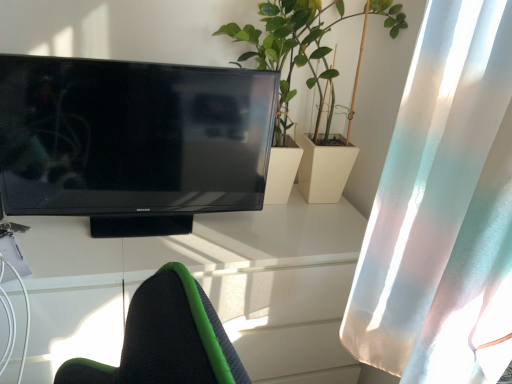
Question: Is white glossy desk at center turned away from translucent white curtain at right?

Choices:
 (A) yes
 (B) no

Answer: (B)

Question: Is white glossy desk at center wider than translucent white curtain at right?

Choices:
 (A) no
 (B) yes

Answer: (B)

Question: Are white glossy desk at center and translucent white curtain at right located far from each other?

Choices:
 (A) yes
 (B) no

Answer: (B)

Question: Could you tell me if white glossy desk at center is turned towards translucent white curtain at right?

Choices:
 (A) yes
 (B) no

Answer: (B)

Question: Can you confirm if white glossy desk at center is taller than translucent white curtain at right?

Choices:
 (A) yes
 (B) no

Answer: (A)

Question: Considering the positions of green leafy plant at center and white glossy desk at center in the image, is green leafy plant at center wider or thinner than white glossy desk at center?

Choices:
 (A) wide
 (B) thin

Answer: (B)

Question: From the image's perspective, is green leafy plant at center above or below white glossy desk at center?

Choices:
 (A) below
 (B) above

Answer: (B)

Question: From a real-world perspective, relative to white glossy desk at center, is green leafy plant at center vertically above or below?

Choices:
 (A) above
 (B) below

Answer: (A)

Question: In the image, is green leafy plant at center on the left side or the right side of white glossy desk at center?

Choices:
 (A) left
 (B) right

Answer: (B)

Question: From their relative heights in the image, would you say translucent white curtain at right is taller or shorter than green leafy plant at center?

Choices:
 (A) tall
 (B) short

Answer: (A)

Question: From a real-world perspective, is translucent white curtain at right physically located above or below green leafy plant at center?

Choices:
 (A) above
 (B) below

Answer: (B)

Question: Would you say translucent white curtain at right is inside or outside green leafy plant at center?

Choices:
 (A) outside
 (B) inside

Answer: (A)

Question: Is translucent white curtain at right in front of or behind green leafy plant at center in the image?

Choices:
 (A) front
 (B) behind

Answer: (A)

Question: Relative to matte black television at left, is white glossy desk at center in front or behind?

Choices:
 (A) front
 (B) behind

Answer: (B)

Question: Would you say white glossy desk at center is inside or outside matte black television at left?

Choices:
 (A) inside
 (B) outside

Answer: (B)